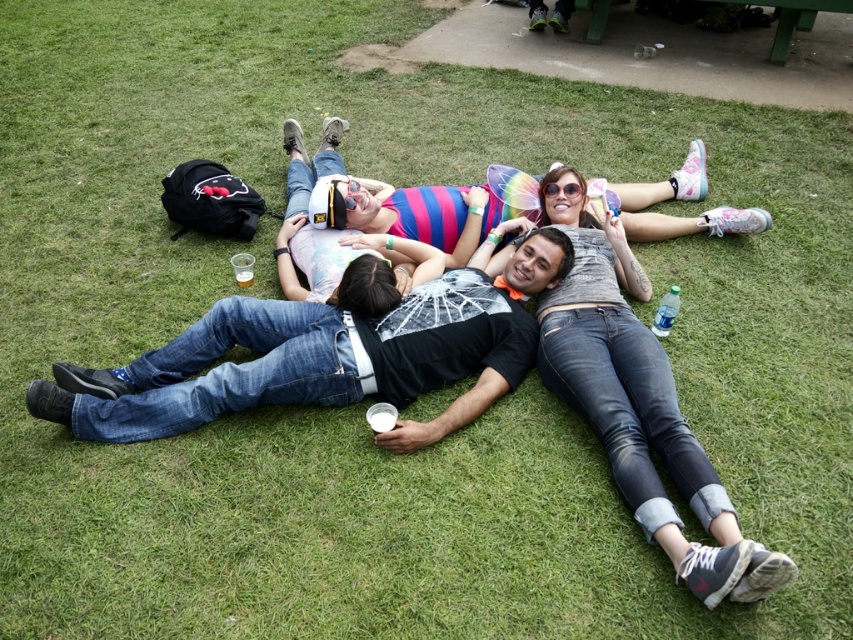
Looking at this image, is jeans at center wider than translucent plastic cup at center?

Yes, jeans at center is wider than translucent plastic cup at center.

Between jeans at center and translucent plastic cup at center, which one appears on the right side from the viewer's perspective?

Positioned to the right is jeans at center.

Which is in front, point (165, 385) or point (238, 280)?

Point (165, 385) is more forward.

I want to click on jeans at center, so click(322, 356).

Can you confirm if jeans at center is smaller than denim jeans at center?

No.

Does point (527, 349) lie in front of point (676, 516)?

That is False.

Describe the element at coordinates (322, 356) in the screenshot. This screenshot has height=640, width=853. I see `jeans at center` at that location.

You are a GUI agent. You are given a task and a screenshot of the screen. Output one action in this format:
    pyautogui.click(x=<x>, y=<y>)
    Task: Click on the jeans at center
    The image size is (853, 640).
    Given the screenshot: What is the action you would take?
    pyautogui.click(x=322, y=356)

Is denim jeans at center to the right of translucent plastic cup at center from the viewer's perspective?

Yes, denim jeans at center is to the right of translucent plastic cup at center.

Does point (639, 364) come behind point (244, 284)?

No.

Locate an element on the screen. The width and height of the screenshot is (853, 640). denim jeans at center is located at coordinates (642, 413).